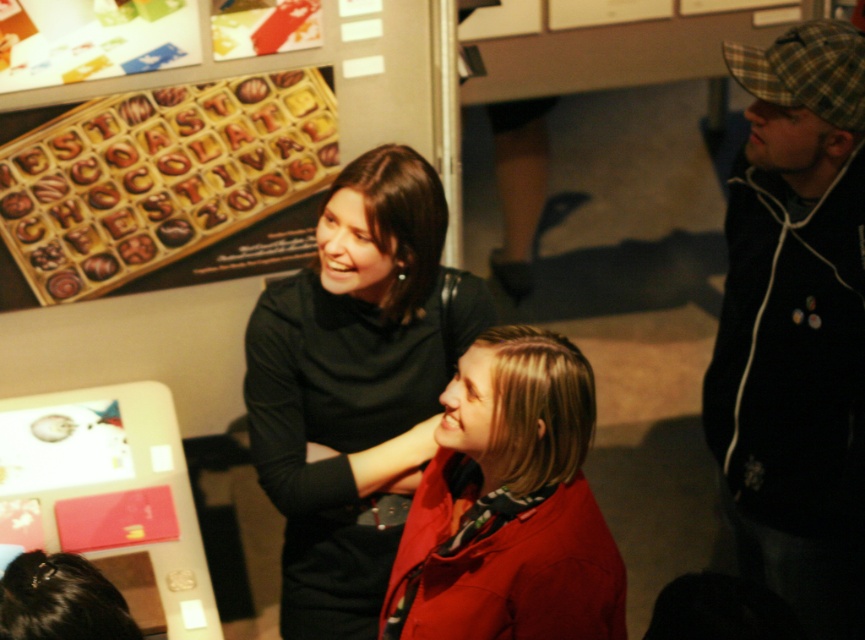
You are standing at the center of the image and want to move towards the black matte dress at center. Which direction should you move in order to reach it?

The black matte dress at center is located at coordinates point (356, 385), so you should move towards the right to reach it.

You are a photographer positioned at the center of the scene. You want to take a photo of the black matte dress at center and the red jacket and patterned scarf at lower right. How far apart are these two items in the image?

The black matte dress at center and the red jacket and patterned scarf at lower right are 1.88 meters apart.

You are at an event and want to find the person wearing the plaid fabric cap at right and the matte red coat at center. Which one is located higher in the image?

The plaid fabric cap at right is positioned over the matte red coat at center, so it is higher in the image.